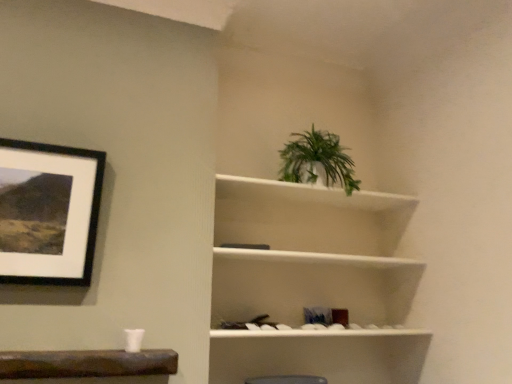
Question: Is white matte shelf at upper right not close to green leafy plant at upper center?

Choices:
 (A) no
 (B) yes

Answer: (A)

Question: Does white matte shelf at upper right have a smaller size compared to green leafy plant at upper center?

Choices:
 (A) no
 (B) yes

Answer: (A)

Question: Considering the relative positions of white matte shelf at upper right and green leafy plant at upper center in the image provided, is white matte shelf at upper right in front of green leafy plant at upper center?

Choices:
 (A) no
 (B) yes

Answer: (B)

Question: From a real-world perspective, is white matte shelf at upper right on top of green leafy plant at upper center?

Choices:
 (A) yes
 (B) no

Answer: (B)

Question: From a real-world perspective, is white matte shelf at upper right physically below green leafy plant at upper center?

Choices:
 (A) no
 (B) yes

Answer: (B)

Question: Is white matte shelf at upper right looking in the opposite direction of green leafy plant at upper center?

Choices:
 (A) no
 (B) yes

Answer: (A)

Question: Would you say green leafy plant at upper center is outside black matte picture frame at upper left?

Choices:
 (A) no
 (B) yes

Answer: (B)

Question: Is green leafy plant at upper center to the left of black matte picture frame at upper left from the viewer's perspective?

Choices:
 (A) yes
 (B) no

Answer: (B)

Question: From a real-world perspective, is green leafy plant at upper center on black matte picture frame at upper left?

Choices:
 (A) yes
 (B) no

Answer: (A)

Question: Is green leafy plant at upper center oriented towards black matte picture frame at upper left?

Choices:
 (A) no
 (B) yes

Answer: (A)

Question: Does green leafy plant at upper center have a lesser width compared to black matte picture frame at upper left?

Choices:
 (A) no
 (B) yes

Answer: (A)

Question: Can you confirm if green leafy plant at upper center is bigger than black matte picture frame at upper left?

Choices:
 (A) yes
 (B) no

Answer: (A)

Question: Is black matte picture frame at upper left not close to white matte shelf at upper right?

Choices:
 (A) yes
 (B) no

Answer: (B)